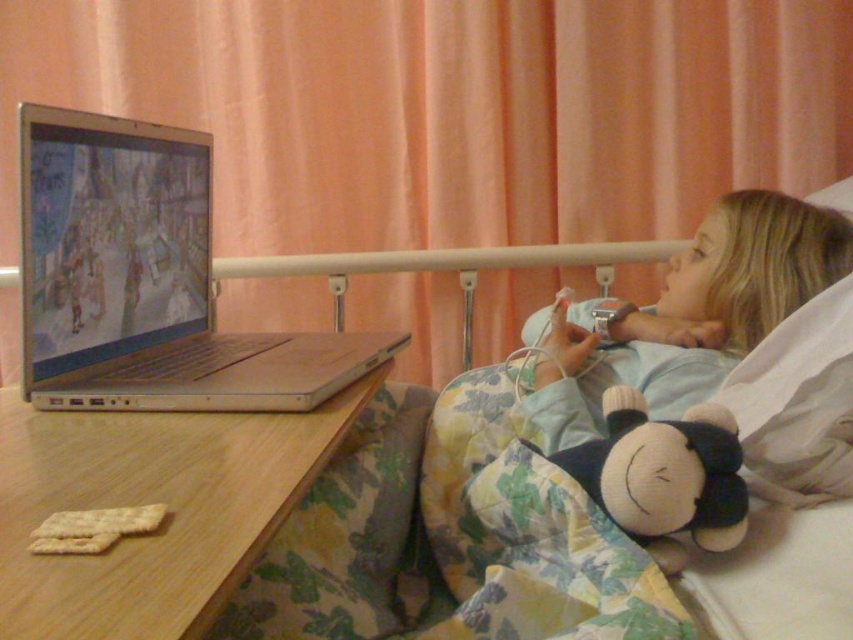
Question: Is silver metallic laptop at left wider than soft fabric monkey at lower right?

Choices:
 (A) yes
 (B) no

Answer: (A)

Question: Does fluffy fabric bed at center have a smaller size compared to soft fabric monkey at lower right?

Choices:
 (A) yes
 (B) no

Answer: (B)

Question: Among these objects, which one is farthest from the camera?

Choices:
 (A) light blue fabric at upper right
 (B) fluffy fabric bed at center

Answer: (A)

Question: Is silver metallic laptop at left thinner than soft fabric monkey at lower right?

Choices:
 (A) yes
 (B) no

Answer: (B)

Question: Which point appears farthest from the camera in this image?

Choices:
 (A) (654, 312)
 (B) (45, 275)
 (C) (653, 502)
 (D) (601, 385)

Answer: (A)

Question: Which is nearer to the silver metallic laptop at left?

Choices:
 (A) soft fabric monkey at lower right
 (B) fluffy fabric bed at center
 (C) light blue fabric at upper right

Answer: (B)